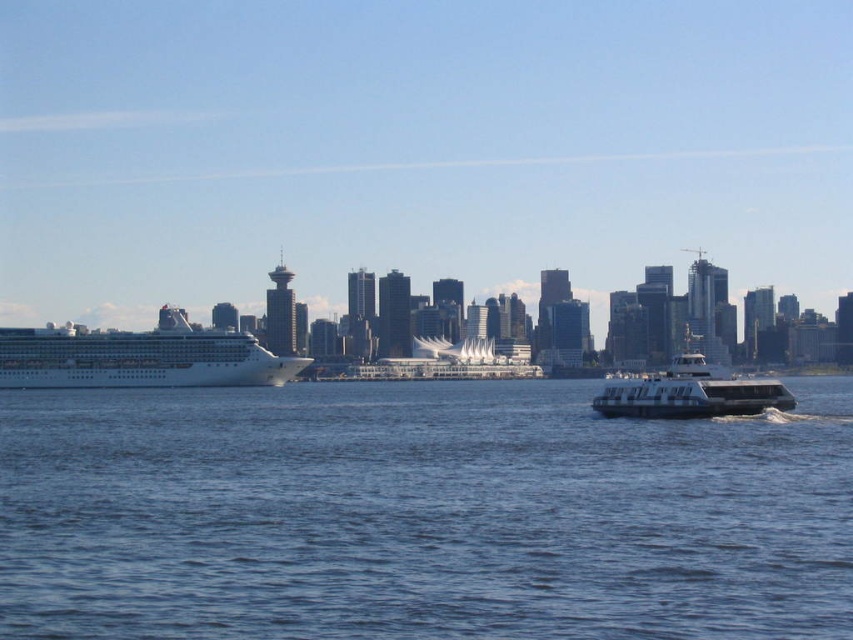
You are a drone operator tasked with capturing aerial footage of the waterfront. Your drone has a maximum flight range of 50 meters. If you are positioned at the white glossy building at center, can you safely fly your drone to the metallic gray ferry at lower right without exceeding its range?

The distance between the metallic gray ferry at lower right and the white glossy building at center is 46.23 meters. Since the drone has a maximum range of 50 meters, you can safely fly it to the ferry as the distance is within the drone